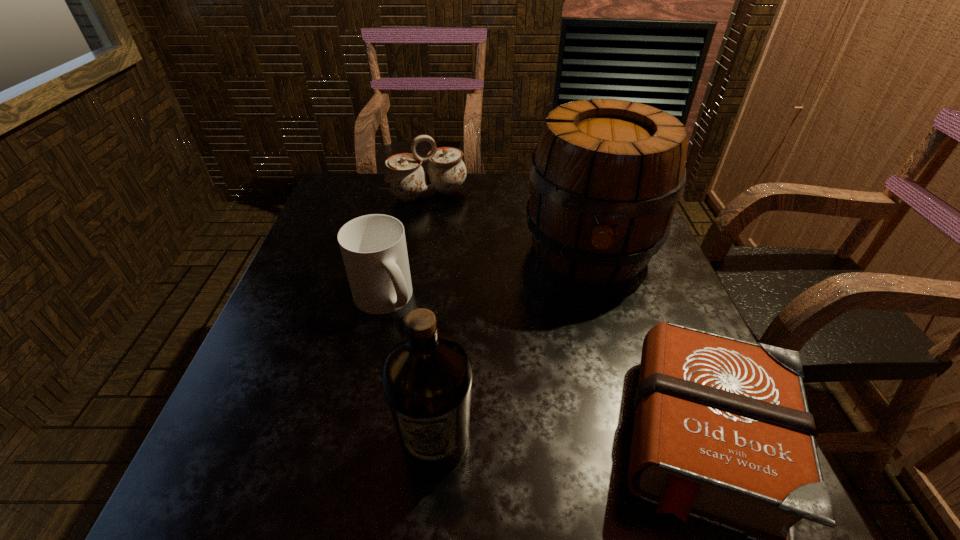
Identify the location of vacant space at the left edge of the desktop. Image resolution: width=960 pixels, height=540 pixels. (282, 391).

Locate an element on the screen. The height and width of the screenshot is (540, 960). vacant space at the right edge is located at coordinates (690, 322).

Locate an element on the screen. This screenshot has width=960, height=540. vacant region at the far left corner of the desktop is located at coordinates (329, 193).

This screenshot has width=960, height=540. I want to click on vacant area between the olive oil and the cider, so click(514, 346).

You are a GUI agent. You are given a task and a screenshot of the screen. Output one action in this format:
    pyautogui.click(x=<x>, y=<y>)
    Task: Click on the unoccupied area between the cider and the chinaware
    The image size is (960, 540).
    Given the screenshot: What is the action you would take?
    pyautogui.click(x=509, y=222)

The width and height of the screenshot is (960, 540). I want to click on vacant space in between the cider and the chinaware, so click(x=509, y=222).

Locate an element on the screen. free space between the cider and the mug is located at coordinates (488, 274).

The image size is (960, 540). I want to click on vacant area that lies between the cider and the mug, so click(488, 274).

Where is `the closest object to the cider`? Image resolution: width=960 pixels, height=540 pixels. the closest object to the cider is located at coordinates (405, 178).

Select which object appears as the closest to the cider. Please provide its 2D coordinates. Your answer should be formatted as a tuple, i.e. [(x, y)], where the tuple contains the x and y coordinates of a point satisfying the conditions above.

[(405, 178)]